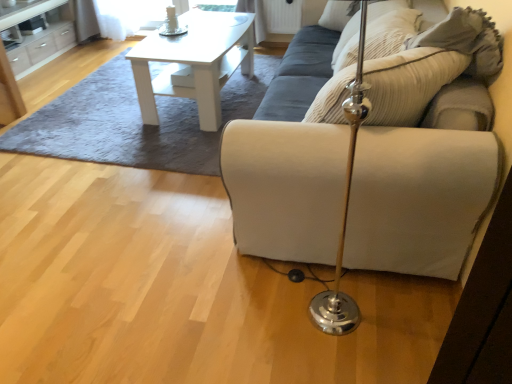
You are a GUI agent. You are given a task and a screenshot of the screen. Output one action in this format:
    pyautogui.click(x=<x>, y=<y>)
    Task: Click on the vacant area on top of white matte table at upper center (from a real-world perspective)
    This screenshot has width=512, height=384.
    Given the screenshot: What is the action you would take?
    pyautogui.click(x=181, y=41)